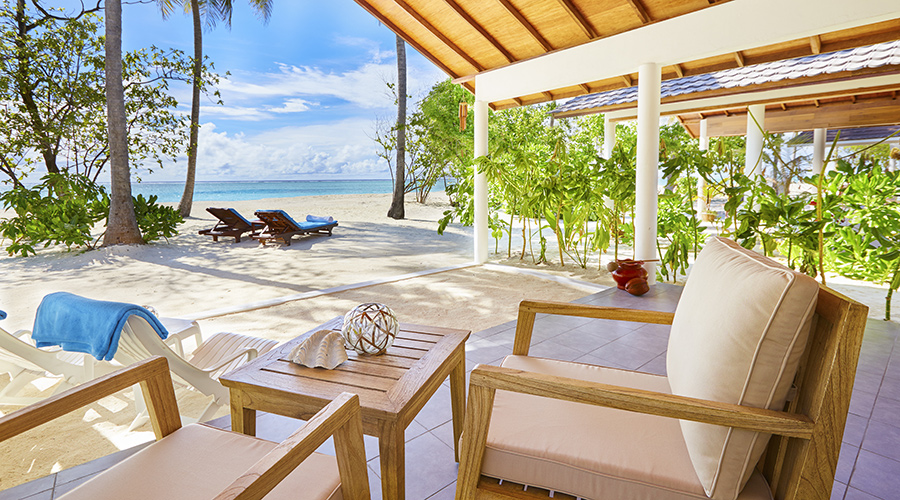
Find the location of a particular element. The height and width of the screenshot is (500, 900). chair arms is located at coordinates (586, 309), (554, 382), (293, 448), (238, 351), (174, 338), (87, 396).